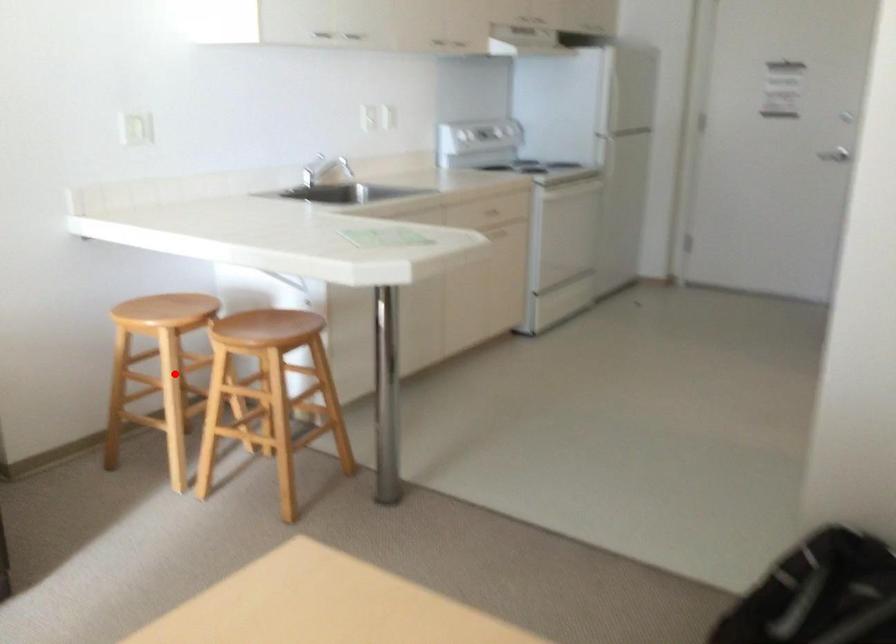
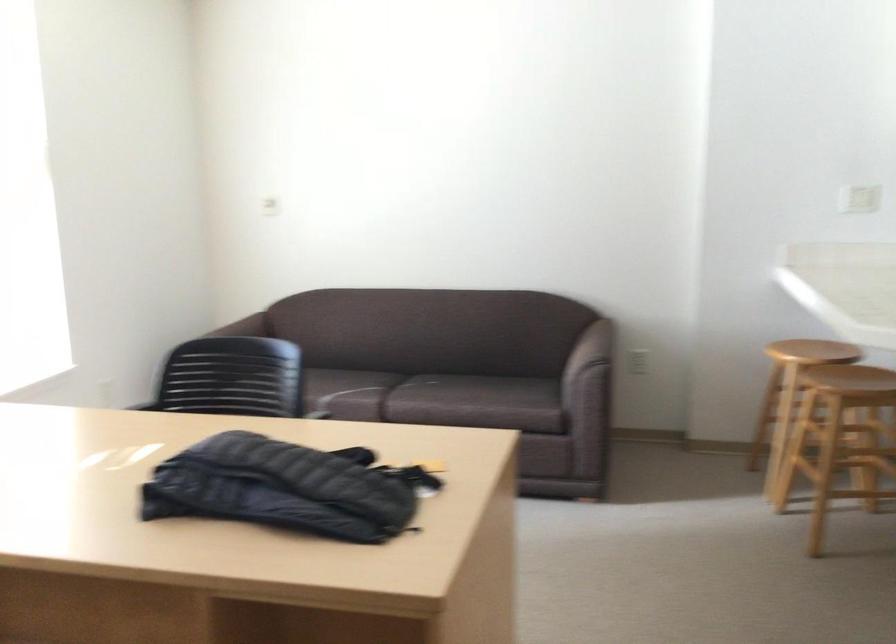
Question: I am providing you with two images of the same scene from different viewpoints. A red point is marked on the first image. At the location where the point appears in image 1, is it still visible in image 2?

Choices:
 (A) Yes
 (B) No

Answer: (A)